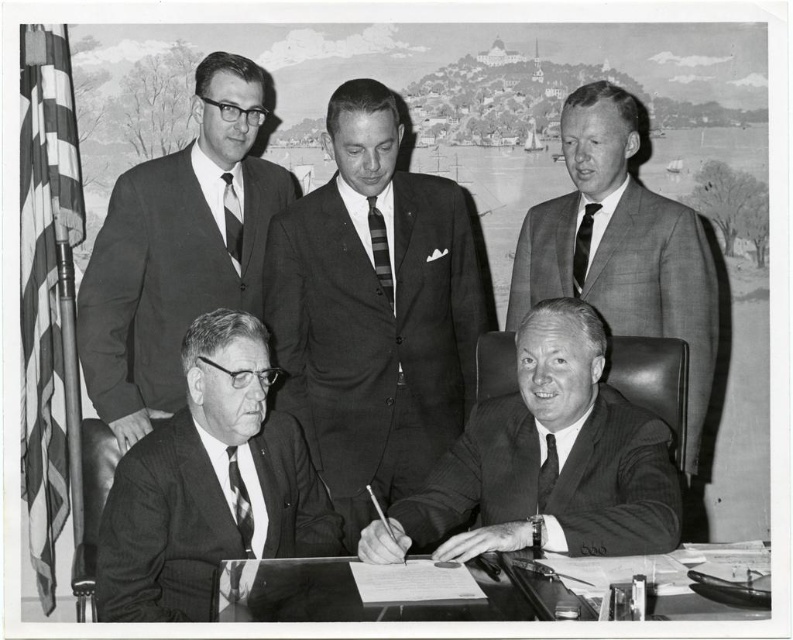
Does point (290, 461) lie behind point (242, 532)?

Yes, it is.

Is smooth black suit at lower left taller than striped fabric tie at lower left?

Indeed, smooth black suit at lower left has a greater height compared to striped fabric tie at lower left.

Does point (213, 449) come in front of point (236, 451)?

Yes.

You are a GUI agent. You are given a task and a screenshot of the screen. Output one action in this format:
    pyautogui.click(x=<x>, y=<y>)
    Task: Click on the smooth black suit at lower left
    Image resolution: width=793 pixels, height=640 pixels.
    Given the screenshot: What is the action you would take?
    pyautogui.click(x=209, y=483)

Does smooth black suit at lower left have a lesser height compared to transparent glass table at lower center?

No, smooth black suit at lower left is not shorter than transparent glass table at lower center.

Between smooth black suit at lower left and transparent glass table at lower center, which one is positioned higher?

smooth black suit at lower left is above.

Locate an element on the screen. smooth black suit at lower left is located at coordinates (209, 483).

Between point (493, 502) and point (546, 445), which one is positioned in front?

Positioned in front is point (546, 445).

Can you confirm if pinstriped suit at center is wider than matte black tie at lower right?

Indeed, pinstriped suit at center has a greater width compared to matte black tie at lower right.

The image size is (793, 640). Identify the location of pinstriped suit at center. (542, 460).